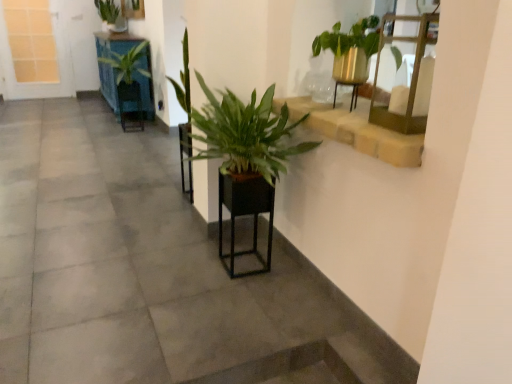
The width and height of the screenshot is (512, 384). Identify the location of vacant area situated below green leafy plant at center, positioned as the 3th houseplant in left-to-right order (from a real-world perspective). (224, 266).